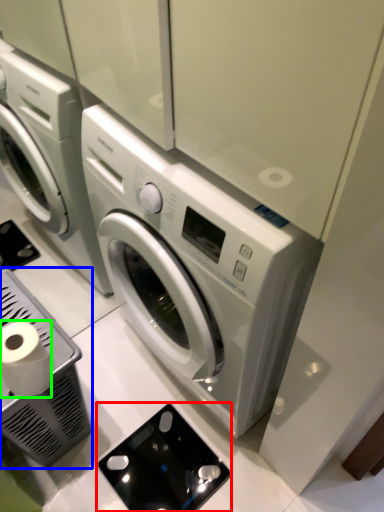
Question: Which object is the farthest from appliance (highlighted by a red box)? Choose among these: appliance (highlighted by a blue box) or toilet paper (highlighted by a green box).

Choices:
 (A) appliance
 (B) toilet paper

Answer: (B)